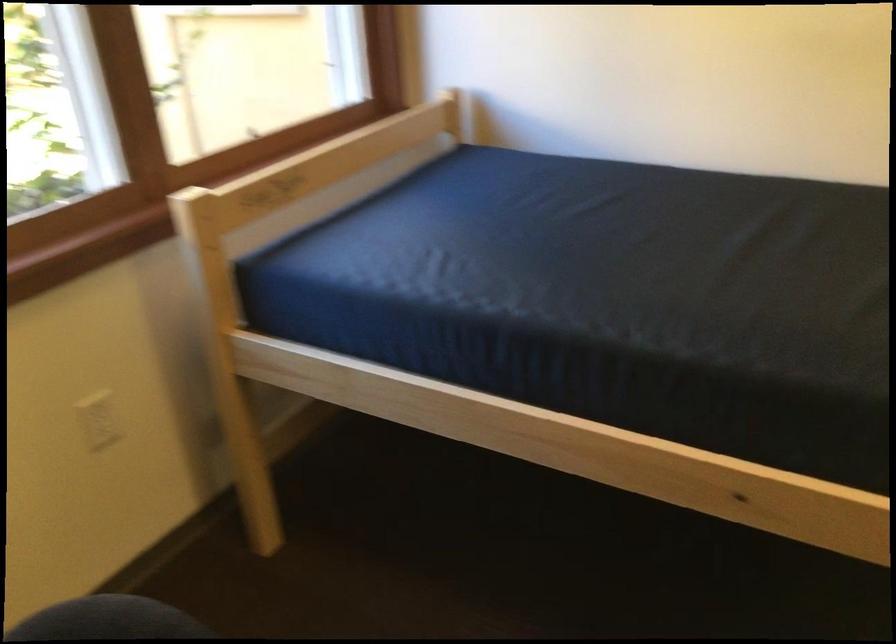
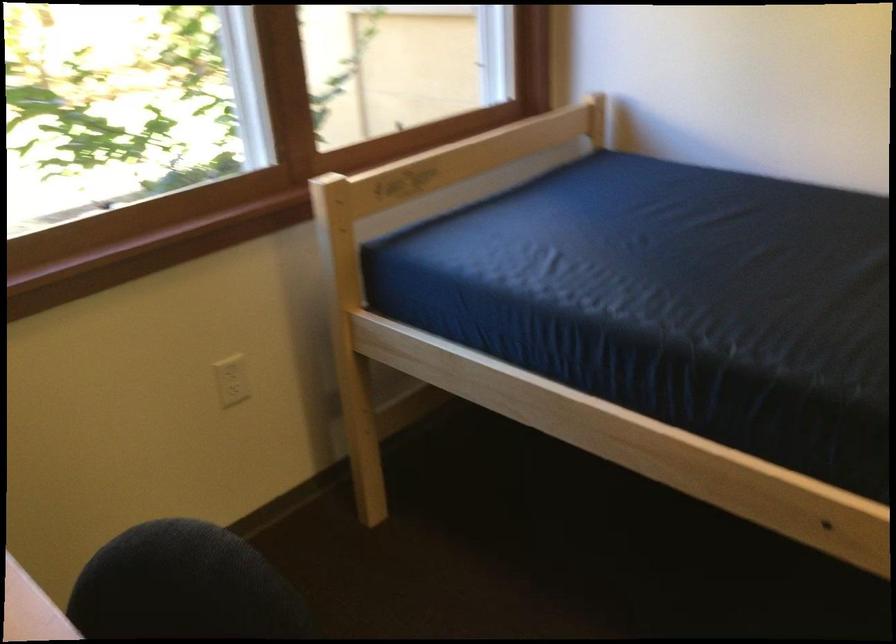
The images are taken continuously from a first-person perspective. In which direction are you moving?

The cameraman walked toward right, backward.